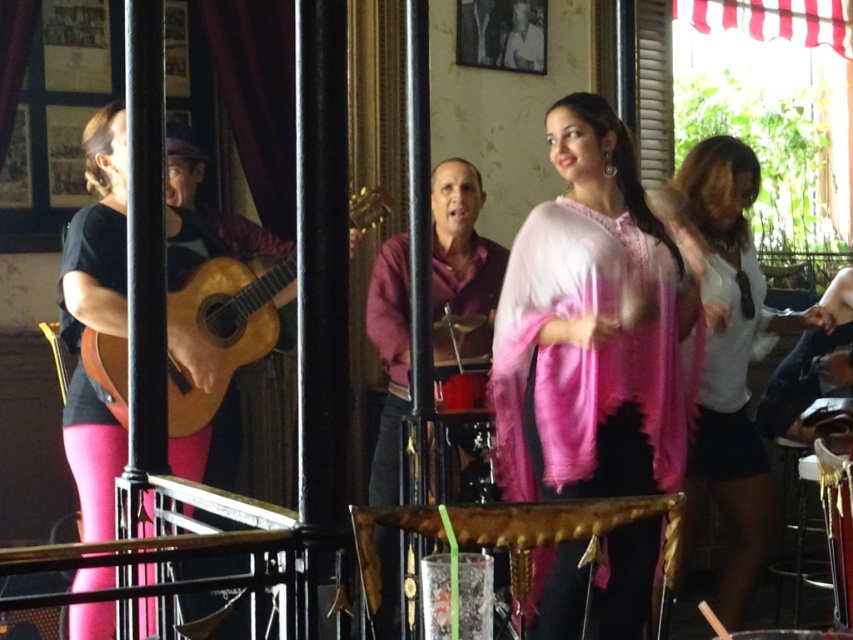
Which is more to the right, white matte shirt at right or maroon sweater at center?

white matte shirt at right is more to the right.

Measure the distance between point (723, 392) and camera.

The distance of point (723, 392) from camera is 3.99 meters.

I want to click on white matte shirt at right, so click(x=729, y=364).

Can you confirm if maroon sweater at center is smaller than wooden acoustic guitar at left?

No.

Is point (468, 230) more distant than point (252, 356)?

Yes, it is behind point (252, 356).

Is point (479, 253) less distant than point (196, 424)?

No, (479, 253) is further to viewer.

Find the location of a particular element. The height and width of the screenshot is (640, 853). maroon sweater at center is located at coordinates (461, 260).

This screenshot has height=640, width=853. Describe the element at coordinates (595, 326) in the screenshot. I see `pink textured scarf at center` at that location.

Which is behind, point (587, 128) or point (248, 336)?

The point (248, 336) is behind.

This screenshot has width=853, height=640. What are the coordinates of `pink textured scarf at center` in the screenshot? It's located at (595, 326).